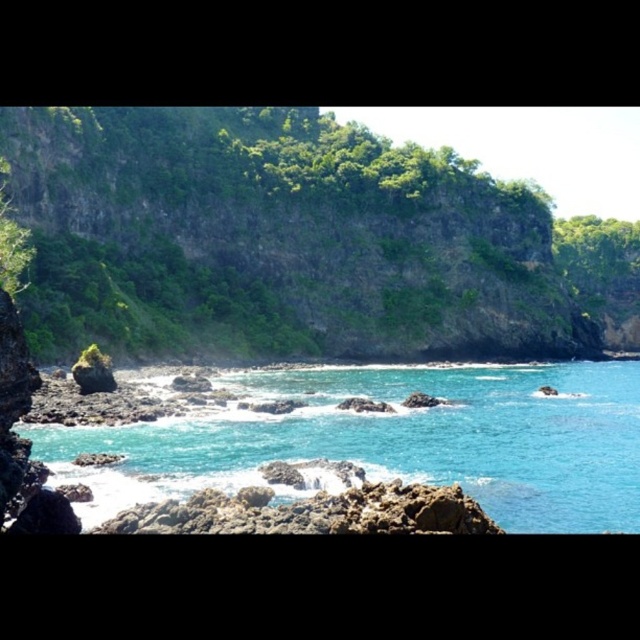
Is the position of green rocky cliff at upper center more distant than that of turquoise glossy water at center?

Yes, it is behind turquoise glossy water at center.

The image size is (640, 640). What are the coordinates of `green rocky cliff at upper center` in the screenshot? It's located at (298, 241).